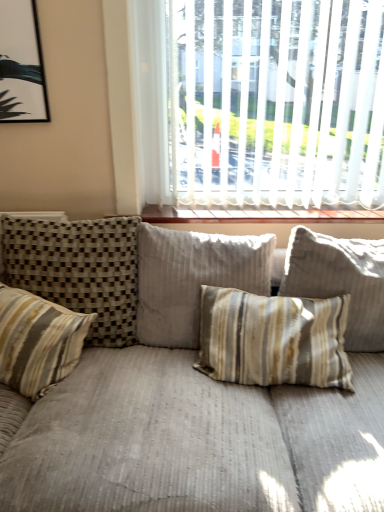
Question: Is white blinds at upper center positioned with its back to striped fabric pillow at center, positioned as the 4th pillow in left-to-right order?

Choices:
 (A) yes
 (B) no

Answer: (B)

Question: Is white blinds at upper center shorter than striped fabric pillow at center, the 1th pillow from the right?

Choices:
 (A) no
 (B) yes

Answer: (A)

Question: Can we say white blinds at upper center lies outside striped fabric pillow at center, the 1th pillow from the right?

Choices:
 (A) yes
 (B) no

Answer: (A)

Question: Considering the relative sizes of white blinds at upper center and striped fabric pillow at center, the 1th pillow from the right, in the image provided, is white blinds at upper center smaller than striped fabric pillow at center, the 1th pillow from the right,?

Choices:
 (A) no
 (B) yes

Answer: (B)

Question: Considering the relative sizes of white blinds at upper center and striped fabric pillow at center, the 1th pillow from the right, in the image provided, is white blinds at upper center taller than striped fabric pillow at center, the 1th pillow from the right,?

Choices:
 (A) no
 (B) yes

Answer: (B)

Question: From a real-world perspective, is white blinds at upper center under striped fabric pillow at center, the 1th pillow from the right?

Choices:
 (A) yes
 (B) no

Answer: (B)

Question: From a real-world perspective, is white blinds at upper center physically below striped fabric pillow at left, which appears as the second pillow when viewed from the left?

Choices:
 (A) no
 (B) yes

Answer: (A)

Question: Considering the relative sizes of white blinds at upper center and striped fabric pillow at left, which appears as the second pillow when viewed from the left, in the image provided, is white blinds at upper center shorter than striped fabric pillow at left, which appears as the second pillow when viewed from the left,?

Choices:
 (A) yes
 (B) no

Answer: (B)

Question: Is white blinds at upper center positioned with its back to striped fabric pillow at left, which appears as the second pillow when viewed from the left?

Choices:
 (A) yes
 (B) no

Answer: (B)

Question: Does white blinds at upper center turn towards striped fabric pillow at left, which appears as the second pillow when viewed from the left?

Choices:
 (A) yes
 (B) no

Answer: (B)

Question: Considering the relative sizes of white blinds at upper center and striped fabric pillow at left, which appears as the second pillow when viewed from the left, in the image provided, is white blinds at upper center taller than striped fabric pillow at left, which appears as the second pillow when viewed from the left,?

Choices:
 (A) yes
 (B) no

Answer: (A)

Question: From a real-world perspective, is white blinds at upper center physically above striped fabric pillow at left, which ranks as the third pillow in right-to-left order?

Choices:
 (A) yes
 (B) no

Answer: (A)

Question: Can you confirm if striped fabric pillow at center, positioned as the 4th pillow in left-to-right order, is shorter than wooden at upper center?

Choices:
 (A) yes
 (B) no

Answer: (B)